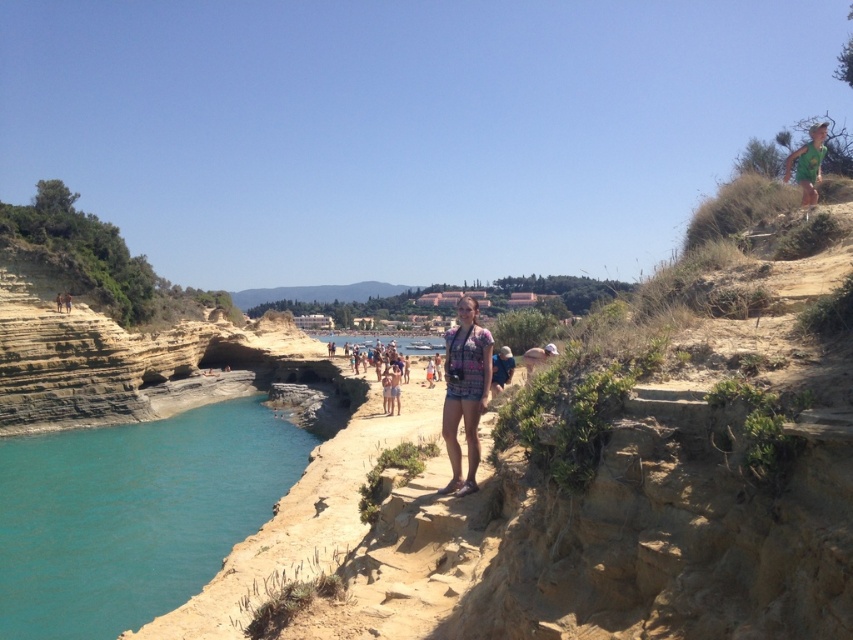
Which is behind, point (479, 394) or point (810, 195)?

Point (810, 195)

Does pink floral shorts at center appear on the left side of green fabric shorts at upper right?

Indeed, pink floral shorts at center is positioned on the left side of green fabric shorts at upper right.

What do you see at coordinates (465, 392) in the screenshot?
I see `pink floral shorts at center` at bounding box center [465, 392].

This screenshot has width=853, height=640. In order to click on pink floral shorts at center in this screenshot , I will do 465,392.

Does turquoise water at lower left come behind matte black shorts at center?

No, it is not.

Is point (76, 554) closer to camera compared to point (70, 300)?

Yes, point (76, 554) is in front of point (70, 300).

The width and height of the screenshot is (853, 640). I want to click on turquoise water at lower left, so click(132, 515).

Does plaid shirt at center appear under tan skin person at center?

Yes, plaid shirt at center is below tan skin person at center.

Does plaid shirt at center appear on the left side of tan skin person at center?

Incorrect, plaid shirt at center is not on the left side of tan skin person at center.

Is point (494, 394) farther from viewer compared to point (59, 294)?

No, it is not.

At what (x,y) coordinates should I click in order to perform the action: click on plaid shirt at center. Please return your answer as a coordinate pair (x, y). This screenshot has width=853, height=640. Looking at the image, I should click on (502, 369).